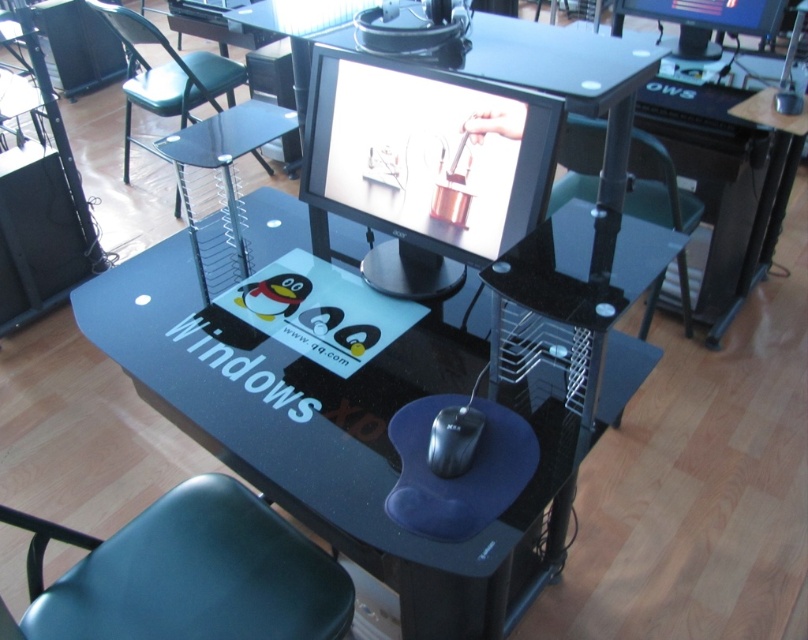
You are sitting in the green plastic chair at upper left and want to reach the black matte mouse at center. Is the mouse below or above your current position?

The green plastic chair at upper left is located above the black matte mouse at center, so the mouse is below your current position.

You are sitting in the green plastic chair at upper left and want to use the matte black monitor at center. Can you comfortably reach the monitor without moving your chair closer?

The matte black monitor at center has a lesser height compared to green plastic chair at upper left, so you can comfortably reach it without moving closer because it is positioned at a lower height.

You are organizing a classroom and need to place a new object on the desk. Considering the transparent glass desk at center and the black matte mouse at center, which object takes up more space on the desk?

The transparent glass desk at center has a larger size compared to the black matte mouse at center, so it takes up more space on the desk.